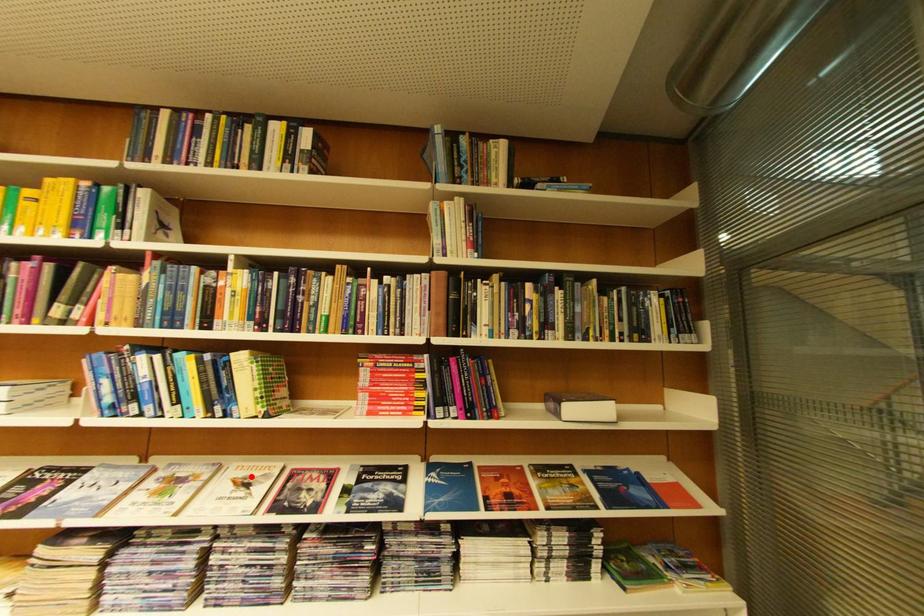
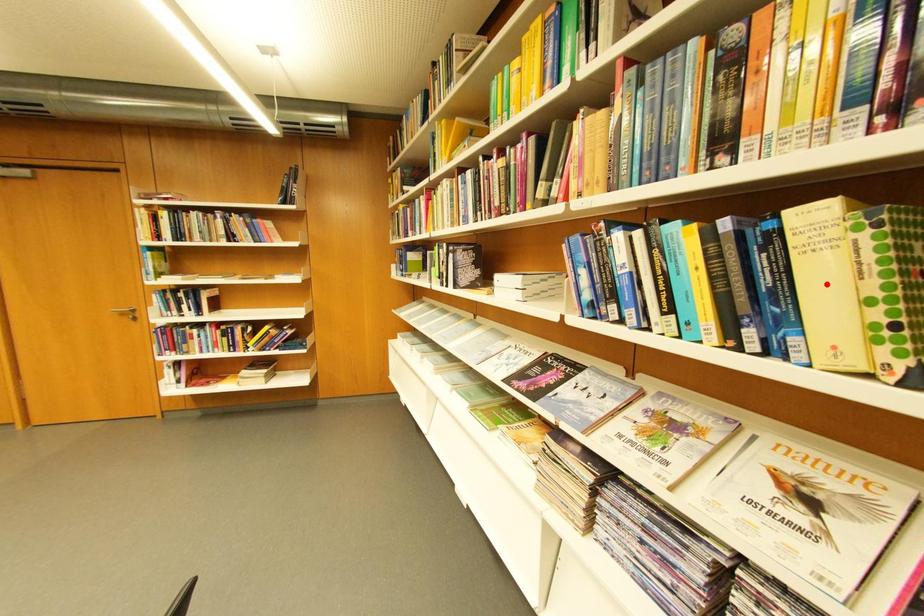
I am providing you with two images of the same scene from different viewpoints. A red point is marked on the first image and another point is marked on the second image. Are the points marked in image1 and image2 representing the same 3D position?

No